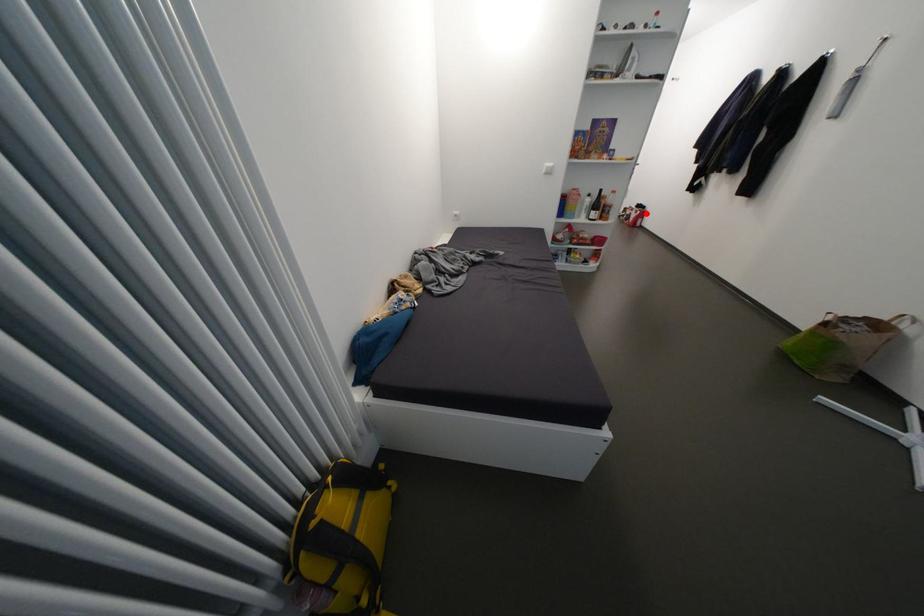
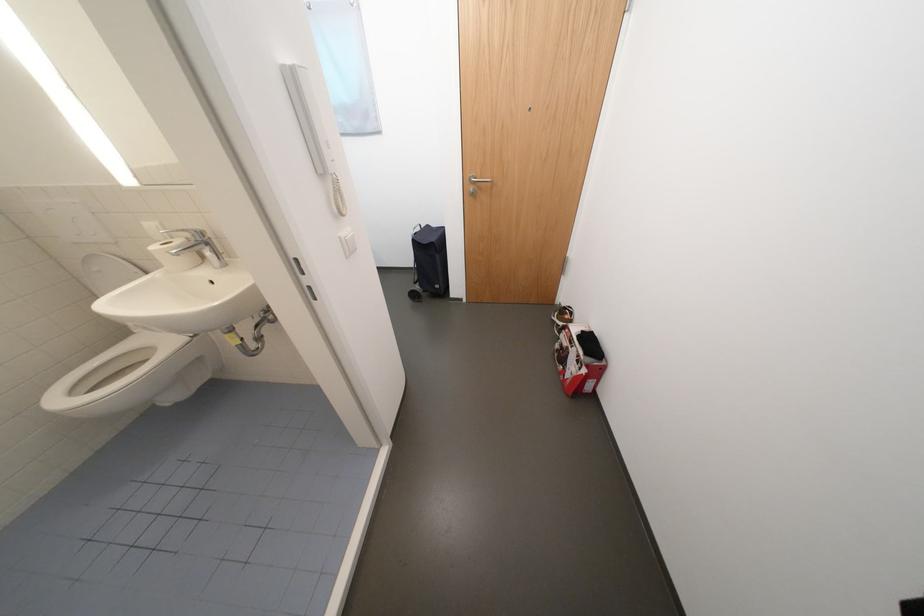
Question: A red point is marked in image1. In image2, is the corresponding 3D point closer to the camera or farther? Reply with the corresponding letter.

Choices:
 (A) The corresponding 3D point is closer.
 (B) The corresponding 3D point is farther.

Answer: (B)